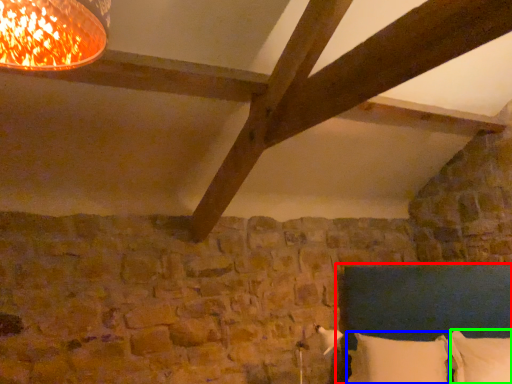
Question: Which object is positioned closest to bed (highlighted by a red box)? Select from pillow (highlighted by a blue box) and pillow (highlighted by a green box).

Choices:
 (A) pillow
 (B) pillow

Answer: (A)